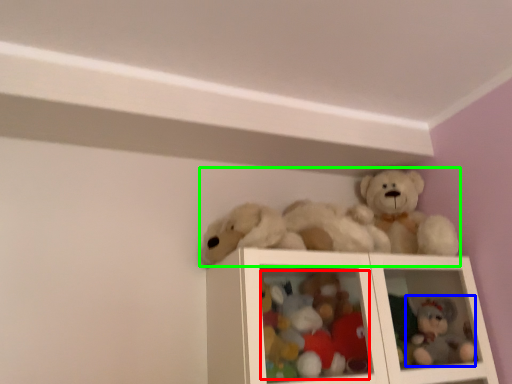
Question: Which object is the farthest from toy (highlighted by a red box)? Choose among these: toy (highlighted by a blue box) or toy (highlighted by a green box).

Choices:
 (A) toy
 (B) toy

Answer: (A)